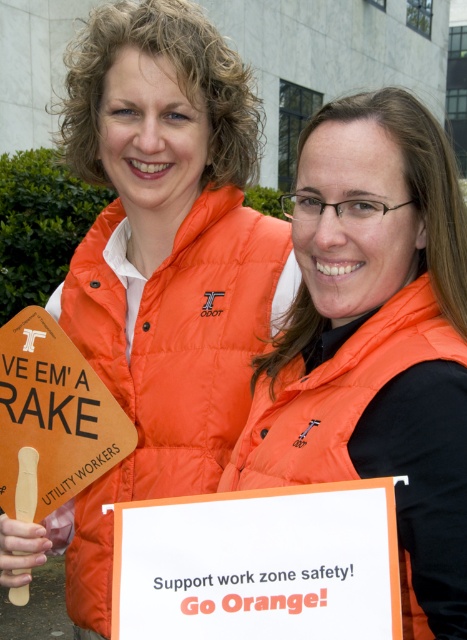
You are standing at the camera position and want to reach the point marked as point (217, 332). If your walking speed is 3 feet per second, how many seconds will it take you to reach that point?

The distance between point (217, 332) and the camera is 8.47 feet. At a walking speed of 3 feet per second, it will take approximately 2.82 seconds to reach the point.

You are a pedestrian trying to read both signs held by the workers. Which sign can you read more clearly from a distance, the white paper sign at center or the woodensign at left?

The white paper sign at center has a larger width than the woodensign at left, so it can be read more clearly from a distance.